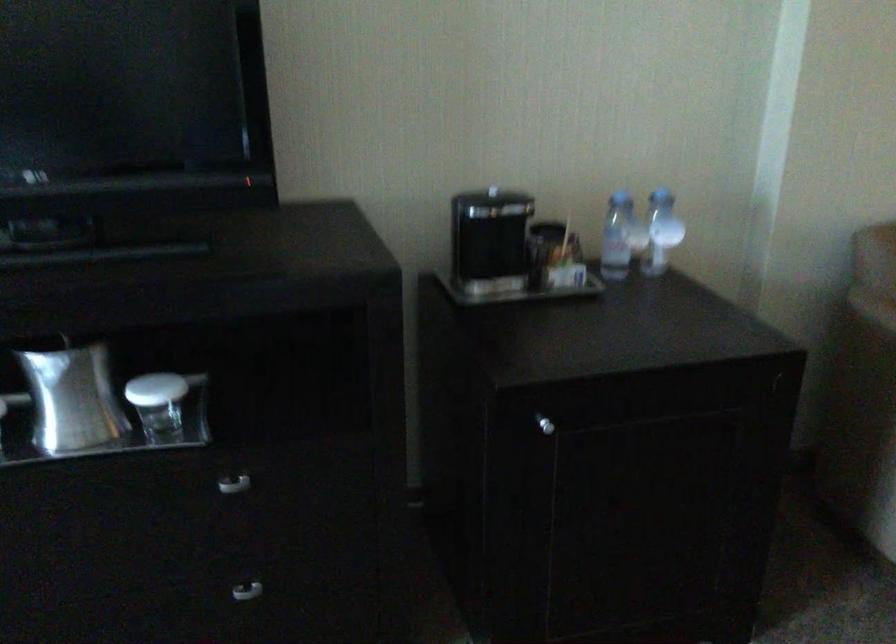
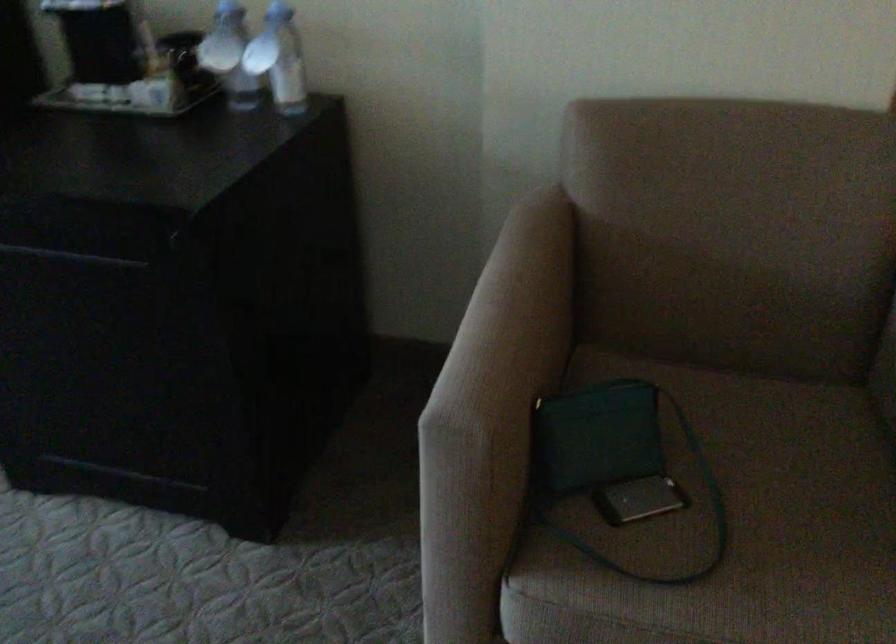
Question: I am providing you with two images of the same scene from different viewpoints. Please identify which objects are invisible in image2.

Choices:
 (A) chair armrest
 (B) chair sitting surface
 (C) plastic water bottle
 (D) none of these

Answer: (D)